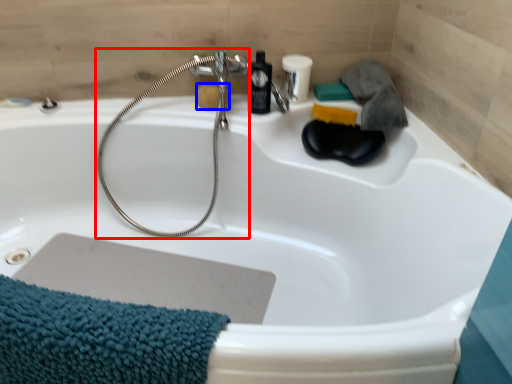
Question: Which point is closer to the camera, garden hose (highlighted by a red box) or soap (highlighted by a blue box)?

Choices:
 (A) garden hose
 (B) soap

Answer: (A)